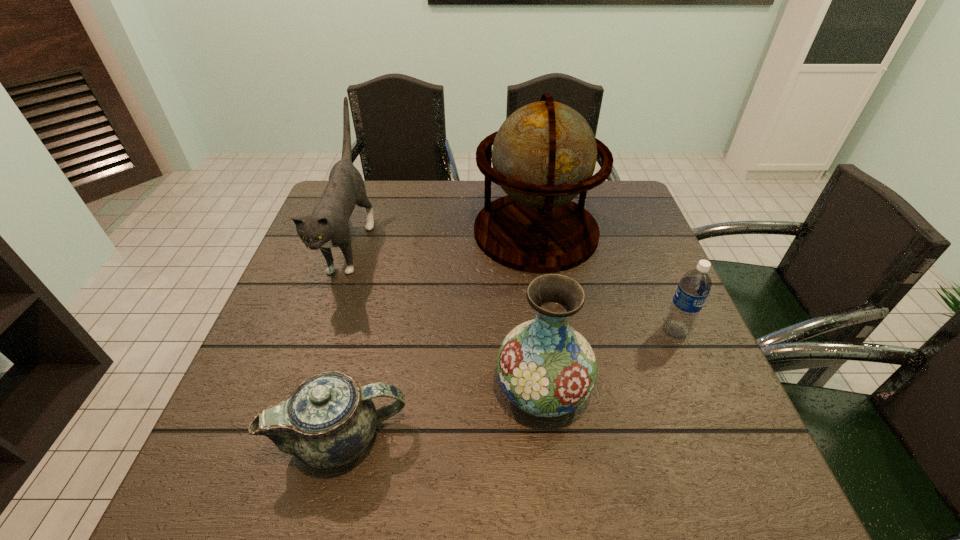
The image size is (960, 540). I want to click on vacant area that satisfies the following two spatial constraints: 1. at the face of the third shortest object; 2. on the left side of the cat, so click(x=300, y=388).

Where is `vacant region that satisfies the following two spatial constraints: 1. at the face of the cat; 2. on the right side of the water bottle`? vacant region that satisfies the following two spatial constraints: 1. at the face of the cat; 2. on the right side of the water bottle is located at coordinates (320, 330).

Find the location of a particular element. This screenshot has width=960, height=540. blank space that satisfies the following two spatial constraints: 1. at the face of the second shortest object; 2. on the right side of the cat is located at coordinates (320, 330).